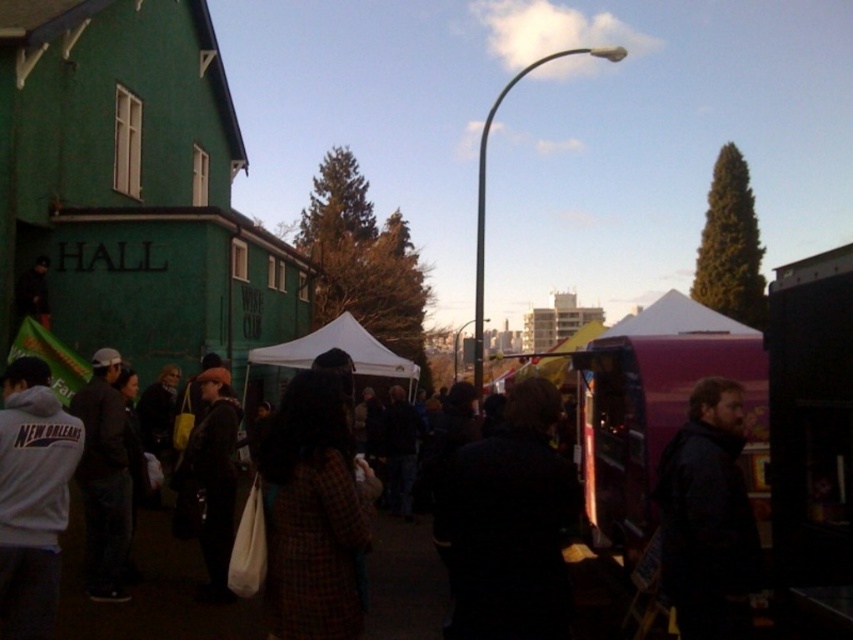
Question: Can you confirm if dark blue jacket at right is positioned to the right of white fleece jacket at lower left?

Choices:
 (A) no
 (B) yes

Answer: (B)

Question: Considering the relative positions of plaid wool coat at center and matte black jacket at center in the image provided, where is plaid wool coat at center located with respect to matte black jacket at center?

Choices:
 (A) above
 (B) below

Answer: (A)

Question: Is white fleece jacket at lower left in front of dark gray jacket at left?

Choices:
 (A) yes
 (B) no

Answer: (A)

Question: Considering the real-world distances, which object is farthest from the white fleece jacket at lower left?

Choices:
 (A) matte black jacket at center
 (B) dark blue jacket at right

Answer: (B)

Question: Which point is closer to the camera taking this photo?

Choices:
 (A) (103, 392)
 (B) (161, 509)
 (C) (25, 506)

Answer: (C)

Question: Among these points, which one is farthest from the camera?

Choices:
 (A) click(206, 376)
 (B) click(7, 476)

Answer: (A)